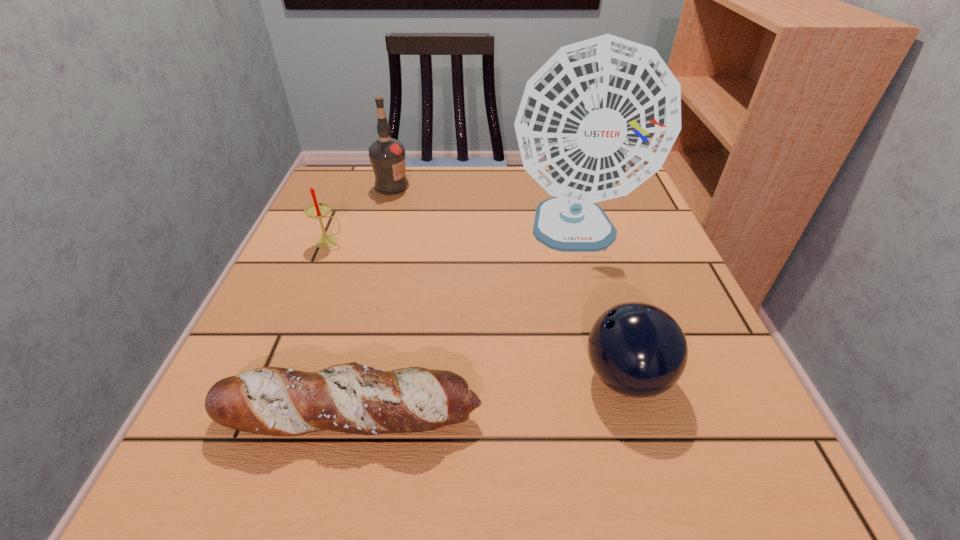
Image resolution: width=960 pixels, height=540 pixels. In order to click on vacant region located on the surface of the bowling ball near the finger holes in this screenshot , I will do `click(470, 377)`.

You are a GUI agent. You are given a task and a screenshot of the screen. Output one action in this format:
    pyautogui.click(x=<x>, y=<y>)
    Task: Click on the free location located 0.190m on the back of the candle
    The width and height of the screenshot is (960, 540).
    Given the screenshot: What is the action you would take?
    pyautogui.click(x=352, y=188)

Identify the location of vacant space located on the back of the shortest object. The height and width of the screenshot is (540, 960). (372, 325).

Where is `fan present at the far edge`? This screenshot has height=540, width=960. fan present at the far edge is located at coordinates (600, 117).

The width and height of the screenshot is (960, 540). I want to click on vodka positioned at the far edge, so click(x=387, y=155).

Where is `object at the near edge`? object at the near edge is located at coordinates (351, 398).

This screenshot has width=960, height=540. What are the coordinates of `vodka that is at the left edge` in the screenshot? It's located at (387, 155).

I want to click on candle that is at the left edge, so click(x=317, y=210).

Find the location of `baguet located at the left edge`. baguet located at the left edge is located at coordinates (351, 398).

Where is `fan that is positioned at the right edge`? This screenshot has width=960, height=540. fan that is positioned at the right edge is located at coordinates (600, 117).